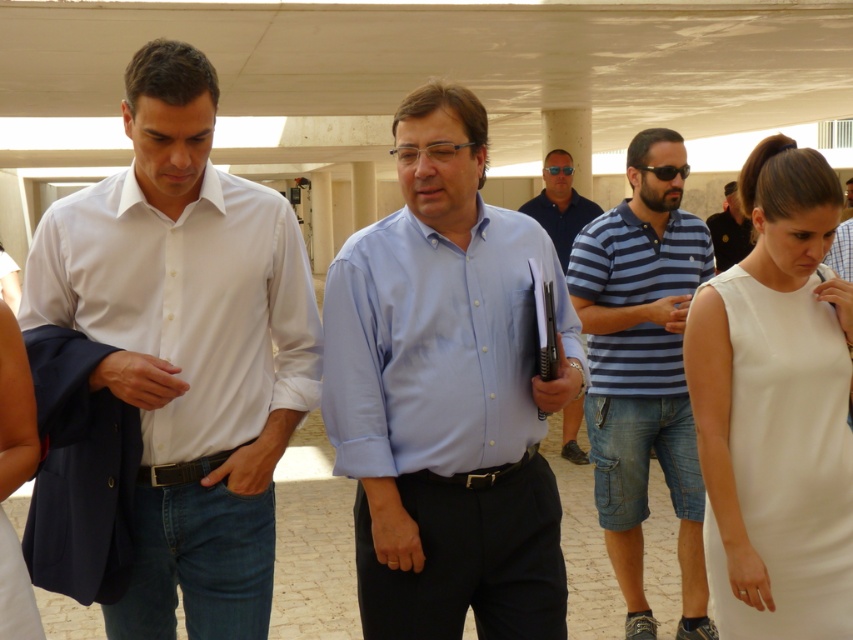
You are standing in the room and need to find the blue striped polo shirt at center. According to the coordinates provided, where should you look to locate it?

The blue striped polo shirt at center is located at point 0.578 on the x axis and 0.755 on the y axis.

You are organizing a charity event and need to decide which outfit to display first. The blue striped polo shirt at center and the white matte dress at right are both candidates. Based on their widths, which one should you choose to ensure it fits in a narrow display stand?

The blue striped polo shirt at center has a lesser width compared to the white matte dress at right, so it will fit better in a narrow display stand.